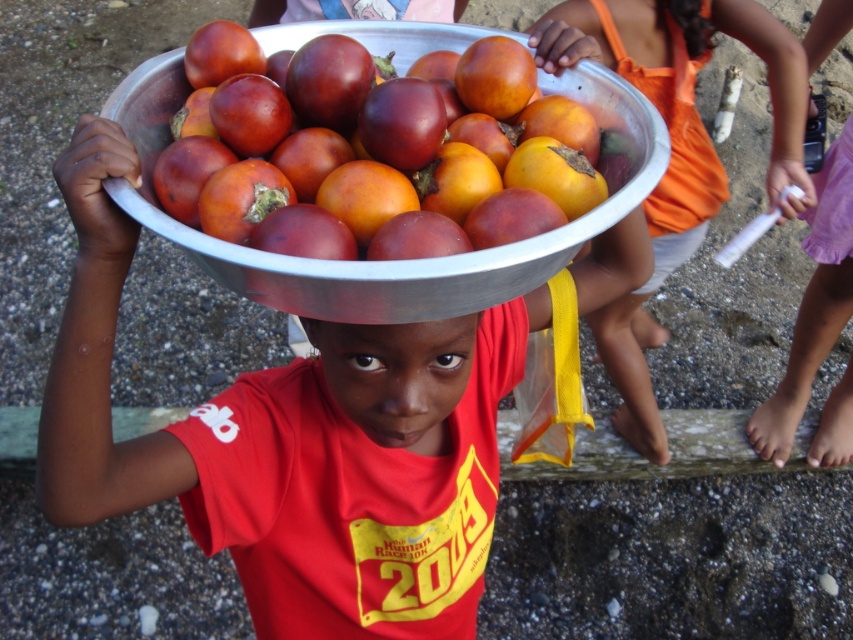
You are a photographer trying to capture the child and the bowls in the image. Which bowl is positioned higher on the child, the shiny metallic bowl at center or the matte orange bowl at center?

The shiny metallic bowl at center is positioned higher than the matte orange bowl at center.

You are helping organize a fruit display and need to choose between placing a matte metallic bowl at center or a shiny metallic bowl at center on a shelf. The shelf has a width of 30 cm. According to the image, which bowl would fit better on the shelf?

The shiny metallic bowl at center has a smaller width compared to the matte metallic bowl at center. Since the shelf is 30 cm wide, the shiny metallic bowl at center would fit better on the shelf.

You are a photographer trying to capture the child balancing a bowl on their head. You have two bowls in the scene, the matte metallic bowl at center and the shiny metallic bowl at center. Which bowl is larger?

The matte metallic bowl at center is bigger than the shiny metallic bowl at center, so the matte metallic bowl at center is the larger one.